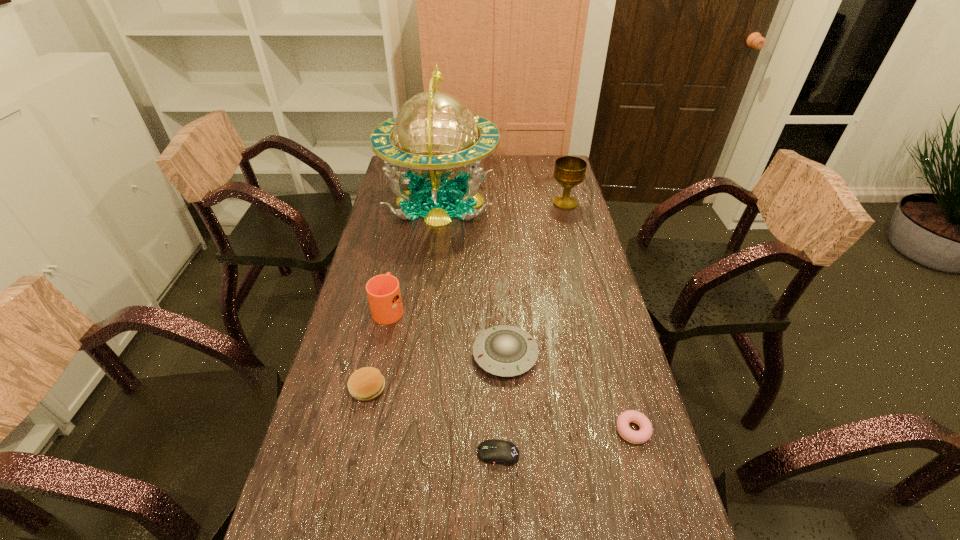
You are a GUI agent. You are given a task and a screenshot of the screen. Output one action in this format:
    pyautogui.click(x=<x>, y=<y>)
    Task: Click on the free space located on the handle side of the mug
    The width and height of the screenshot is (960, 540).
    Given the screenshot: What is the action you would take?
    pyautogui.click(x=407, y=221)

Where is `vacant space located 0.180m on the handle side of the mug`? vacant space located 0.180m on the handle side of the mug is located at coordinates pyautogui.click(x=400, y=256).

This screenshot has width=960, height=540. I want to click on vacant space situated 0.130m on the handle side of the mug, so click(x=398, y=266).

Find the location of a particular element. This screenshot has height=540, width=960. vacant area located 0.260m on the front of the saucer is located at coordinates [513, 485].

Image resolution: width=960 pixels, height=540 pixels. In order to click on vacant space situated on the back of the patty in this screenshot , I will do `click(392, 280)`.

Locate an element on the screen. The image size is (960, 540). free location located 0.370m on the left of the doughnut is located at coordinates (457, 430).

What are the coordinates of `vacant space located 0.360m on the left of the computer equipment` in the screenshot? It's located at (316, 454).

Locate an element on the screen. This screenshot has width=960, height=540. object present at the far edge is located at coordinates (435, 134).

Image resolution: width=960 pixels, height=540 pixels. In order to click on globe that is at the left edge in this screenshot , I will do `click(435, 134)`.

Image resolution: width=960 pixels, height=540 pixels. Identify the location of mug located in the left edge section of the desktop. (383, 291).